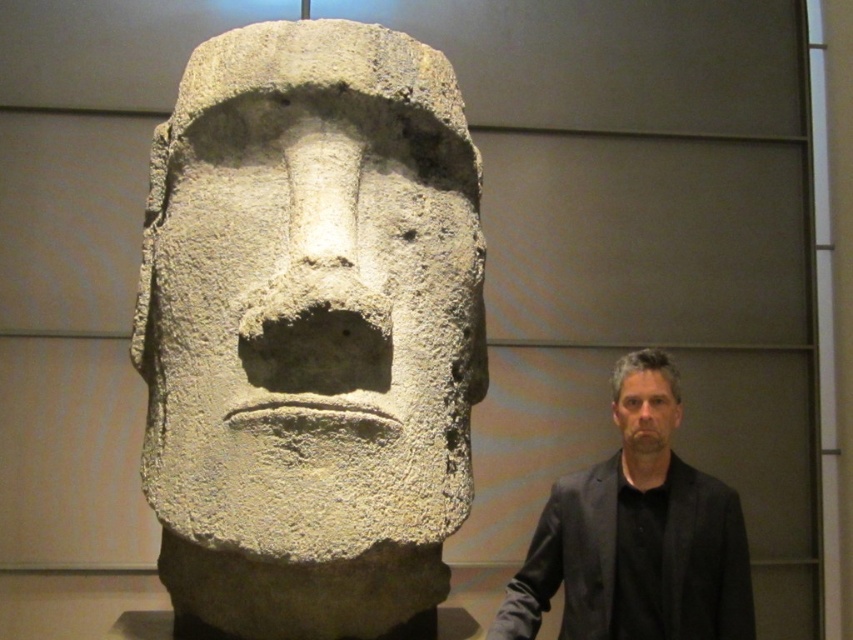
Question: Does white stone sculpture at center appear under dark gray suit at right?

Choices:
 (A) yes
 (B) no

Answer: (B)

Question: Among these objects, which one is nearest to the camera?

Choices:
 (A) gray stone face at right
 (B) dark gray suit at right

Answer: (B)

Question: Does white stone sculpture at center have a lesser width compared to gray stone face at right?

Choices:
 (A) no
 (B) yes

Answer: (A)

Question: Where is dark gray suit at right located in relation to smooth gray stone head at center in the image?

Choices:
 (A) above
 (B) below

Answer: (B)

Question: Among these objects, which one is farthest from the camera?

Choices:
 (A) gray stone face at right
 (B) white stone sculpture at center
 (C) smooth gray stone head at center
 (D) dark gray suit at right

Answer: (A)

Question: Which is farther from the smooth gray stone head at center?

Choices:
 (A) white stone sculpture at center
 (B) gray stone face at right
 (C) dark gray suit at right

Answer: (A)